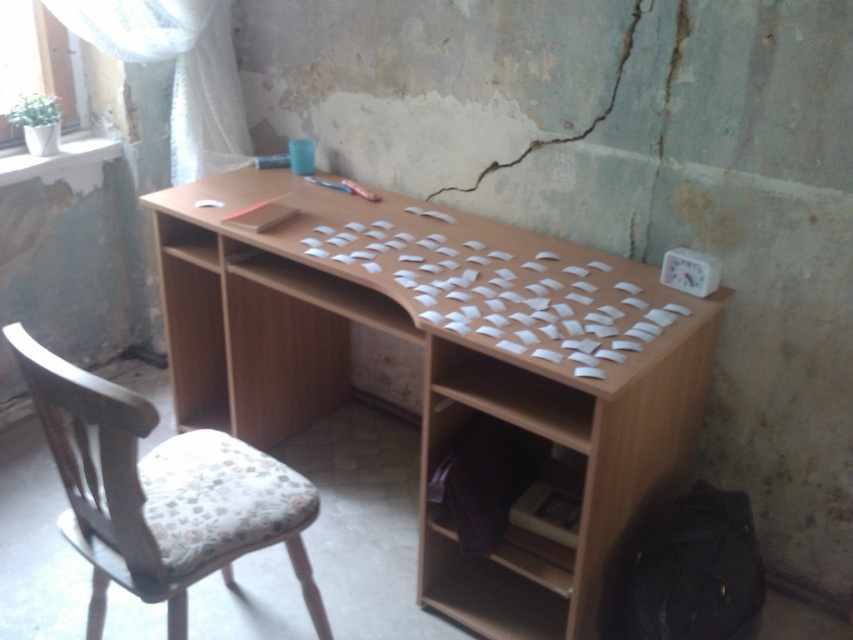
Question: Which of the following is the closest to the observer?

Choices:
 (A) (49, 355)
 (B) (106, 35)

Answer: (A)

Question: Can you confirm if light brown wood desk at center is positioned below woodenwoodenchair at left?

Choices:
 (A) no
 (B) yes

Answer: (A)

Question: In this image, where is light brown wood desk at center located relative to white sheer curtain at upper left?

Choices:
 (A) above
 (B) below

Answer: (B)

Question: Which point is farther to the camera?

Choices:
 (A) light brown wood desk at center
 (B) woodenwoodenchair at left

Answer: (A)

Question: Considering the relative positions of light brown wood desk at center and white sheer curtain at upper left in the image provided, where is light brown wood desk at center located with respect to white sheer curtain at upper left?

Choices:
 (A) left
 (B) right

Answer: (B)

Question: Which object is the closest to the light brown wood desk at center?

Choices:
 (A) white sheer curtain at upper left
 (B) woodenwoodenchair at left

Answer: (B)